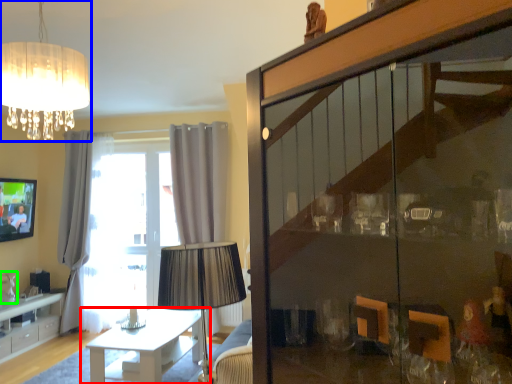
Question: Which object is the closest to the table (highlighted by a red box)? Choose among these: lamp (highlighted by a blue box) or glass vase (highlighted by a green box).

Choices:
 (A) lamp
 (B) glass vase

Answer: (B)